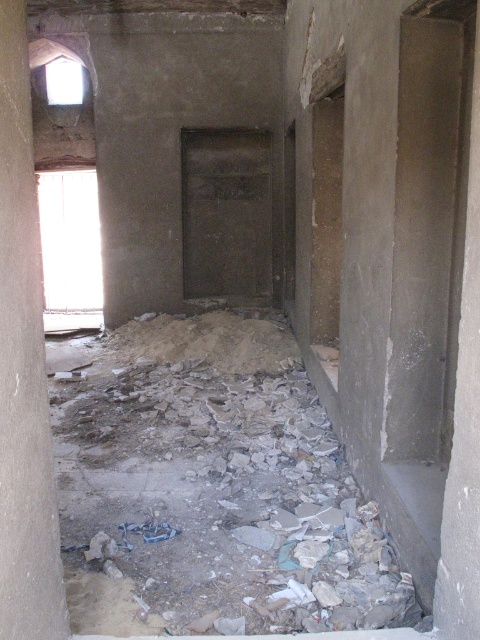
Question: Can you confirm if crumbly concrete debris at lower center is positioned above gray concrete pillar at left?

Choices:
 (A) no
 (B) yes

Answer: (A)

Question: Which point appears closest to the camera in this image?

Choices:
 (A) (178, 589)
 (B) (62, 634)

Answer: (B)

Question: Is crumbly concrete debris at lower center bigger than transparent glass window at upper left?

Choices:
 (A) yes
 (B) no

Answer: (A)

Question: Is crumbly concrete debris at lower center smaller than gray concrete pillar at left?

Choices:
 (A) yes
 (B) no

Answer: (B)

Question: Estimate the real-world distances between objects in this image. Which object is farther from the crumbly concrete debris at lower center?

Choices:
 (A) gray concrete pillar at left
 (B) transparent glass window at upper left

Answer: (B)

Question: Which of these objects is positioned closest to the transparent glass window at upper left?

Choices:
 (A) gray concrete pillar at left
 (B) crumbly concrete debris at lower center

Answer: (B)